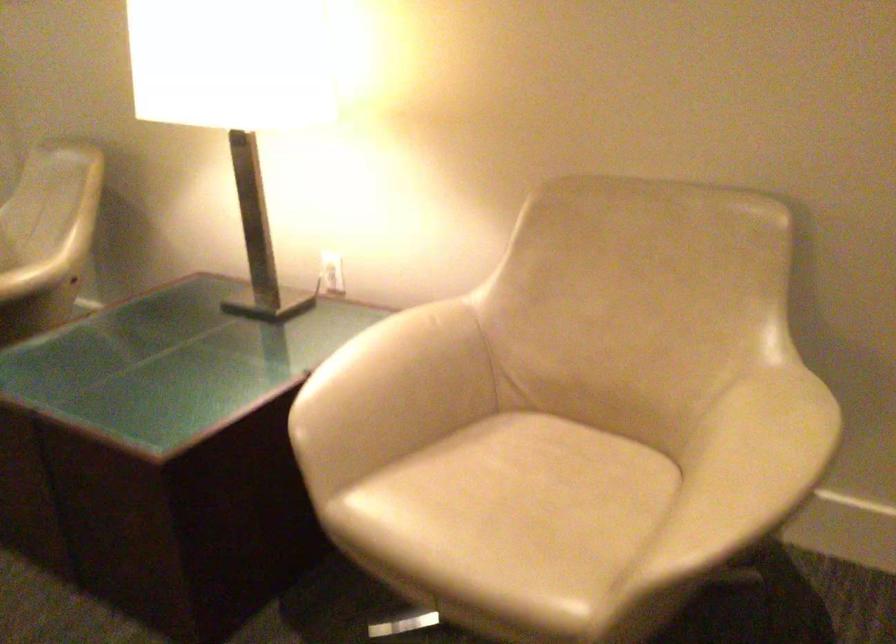
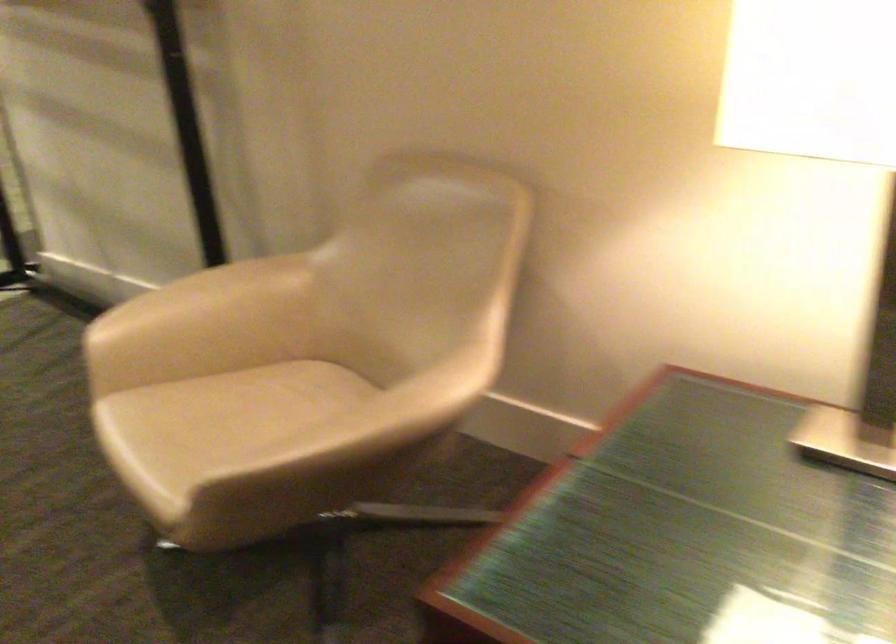
The images are taken continuously from a first-person perspective. In which direction are you moving?

The movement direction of the cameraman is left, forward.